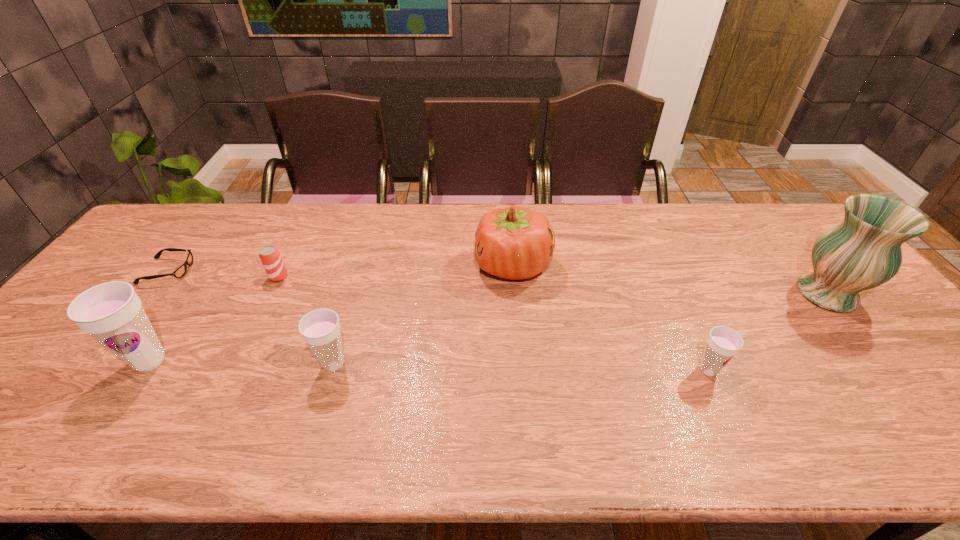
The height and width of the screenshot is (540, 960). In order to click on the tallest cup in this screenshot , I will do `click(112, 313)`.

At what (x,y) coordinates should I click in order to perform the action: click on the fourth object from left to right. Please return your answer as a coordinate pair (x, y). Image resolution: width=960 pixels, height=540 pixels. Looking at the image, I should click on (320, 328).

What are the coordinates of `the second shortest cup` in the screenshot? It's located at (320, 328).

At what (x,y) coordinates should I click in order to perform the action: click on the fifth tallest object. Please return your answer as a coordinate pair (x, y). The height and width of the screenshot is (540, 960). Looking at the image, I should click on (723, 343).

You are a GUI agent. You are given a task and a screenshot of the screen. Output one action in this format:
    pyautogui.click(x=<x>, y=<y>)
    Task: Click on the rightmost cup
    
    Given the screenshot: What is the action you would take?
    pyautogui.click(x=723, y=343)

Where is `vase`? The width and height of the screenshot is (960, 540). vase is located at coordinates click(863, 252).

You are a GUI agent. You are given a task and a screenshot of the screen. Output one action in this format:
    pyautogui.click(x=<x>, y=<y>)
    Task: Click on the rightmost object
    
    Given the screenshot: What is the action you would take?
    pyautogui.click(x=863, y=252)

Find the location of a particular element. The width and height of the screenshot is (960, 540). pumpkin is located at coordinates (515, 243).

Identify the location of the shortest object. Image resolution: width=960 pixels, height=540 pixels. (179, 272).

Identify the location of beer can. (270, 257).